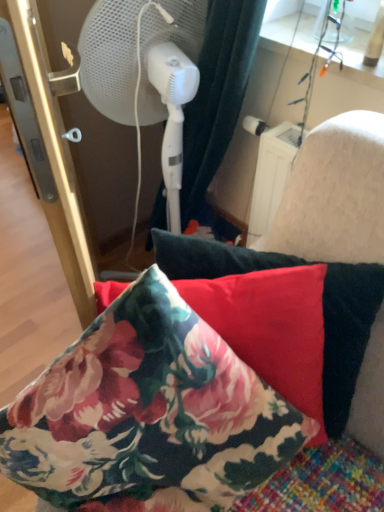
Question: Is white plastic mechanical fan at left thinner than floral fabric pillow at center?

Choices:
 (A) no
 (B) yes

Answer: (A)

Question: Considering the relative sizes of white plastic mechanical fan at left and floral fabric pillow at center in the image provided, is white plastic mechanical fan at left shorter than floral fabric pillow at center?

Choices:
 (A) no
 (B) yes

Answer: (A)

Question: From the image's perspective, is white plastic mechanical fan at left located above floral fabric pillow at center?

Choices:
 (A) yes
 (B) no

Answer: (A)

Question: Does white plastic mechanical fan at left have a greater height compared to floral fabric pillow at center?

Choices:
 (A) no
 (B) yes

Answer: (B)

Question: From a real-world perspective, is white plastic mechanical fan at left over floral fabric pillow at center?

Choices:
 (A) no
 (B) yes

Answer: (B)

Question: Is white plastic mechanical fan at left bigger than floral fabric pillow at center?

Choices:
 (A) yes
 (B) no

Answer: (B)

Question: From the image's perspective, does floral fabric pillow at center appear higher than white plastic mechanical fan at left?

Choices:
 (A) no
 (B) yes

Answer: (A)

Question: From the image's perspective, is floral fabric pillow at center beneath white plastic mechanical fan at left?

Choices:
 (A) yes
 (B) no

Answer: (A)

Question: Does floral fabric pillow at center have a greater height compared to white plastic mechanical fan at left?

Choices:
 (A) no
 (B) yes

Answer: (A)

Question: Is floral fabric pillow at center aimed at white plastic mechanical fan at left?

Choices:
 (A) yes
 (B) no

Answer: (B)

Question: Is floral fabric pillow at center positioned behind white plastic mechanical fan at left?

Choices:
 (A) no
 (B) yes

Answer: (A)

Question: Is floral fabric pillow at center bigger than white plastic mechanical fan at left?

Choices:
 (A) no
 (B) yes

Answer: (B)

Question: Is point (198, 260) positioned closer to the camera than point (196, 41)?

Choices:
 (A) farther
 (B) closer

Answer: (B)